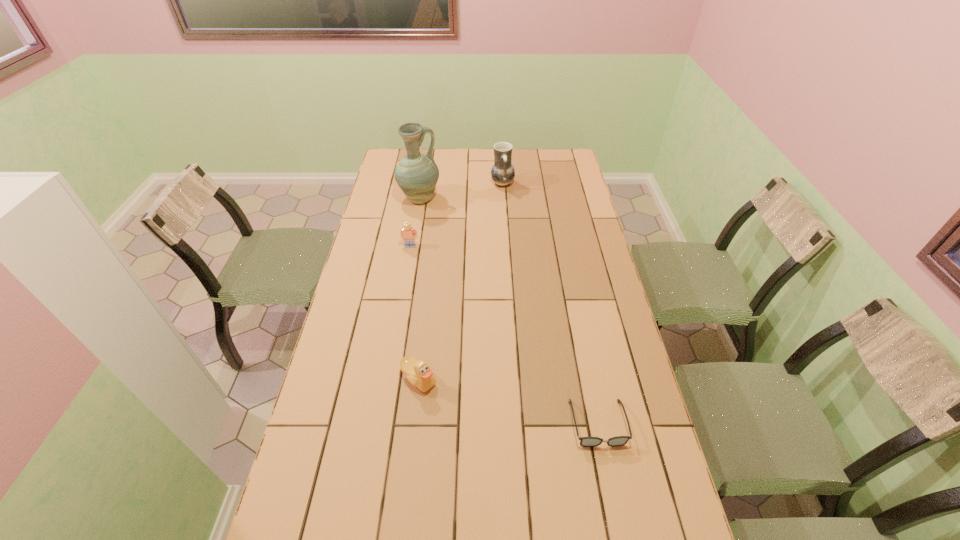
The image size is (960, 540). Find the location of `pitcher`. pitcher is located at coordinates click(417, 174).

The image size is (960, 540). Identify the location of the second object from right to left. (502, 173).

Where is `pottery`? This screenshot has height=540, width=960. pottery is located at coordinates (502, 173).

Find the location of a particular element. The width and height of the screenshot is (960, 540). the third nearest object is located at coordinates (408, 232).

This screenshot has height=540, width=960. I want to click on the fourth farthest object, so click(x=418, y=373).

The width and height of the screenshot is (960, 540). Identify the location of duck. (418, 373).

This screenshot has width=960, height=540. I want to click on the rightmost object, so click(618, 440).

Where is `the shortest object`? the shortest object is located at coordinates (618, 440).

Identify the location of vacant region located 0.400m on the handle side of the tallest object. The image size is (960, 540). (533, 199).

You are a GUI agent. You are given a task and a screenshot of the screen. Output one action in this format:
    pyautogui.click(x=<x>, y=<y>)
    Task: Click on the free space located 0.170m on the left of the fourth shortest object
    The height and width of the screenshot is (540, 960).
    Given the screenshot: What is the action you would take?
    pyautogui.click(x=454, y=184)